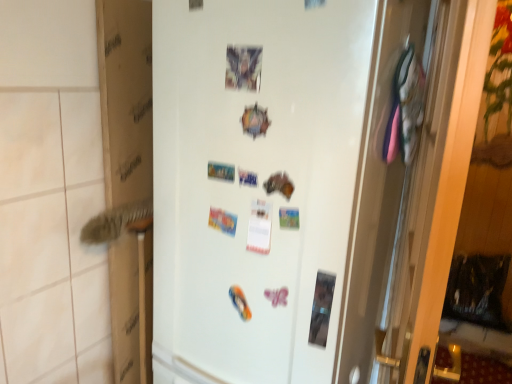
Locate an element on the screen. The height and width of the screenshot is (384, 512). cardboard at left is located at coordinates (126, 99).

Where is `white matte refrigerator at center`? white matte refrigerator at center is located at coordinates (254, 185).

Image resolution: width=512 pixels, height=384 pixels. Identify the location of cardboard at left. (126, 99).

From the picture: Does cardboard at left turn towards matte plastic postcard at upper center?

Yes, cardboard at left faces towards matte plastic postcard at upper center.

What's the angular difference between cardboard at left and matte plastic postcard at upper center's facing directions?

cardboard at left and matte plastic postcard at upper center are facing 88.6 degrees away from each other.

Does point (150, 260) come farther from viewer compared to point (254, 63)?

Yes, it is.

In terms of size, does cardboard at left appear bigger or smaller than matte plastic postcard at upper center?

cardboard at left is bigger than matte plastic postcard at upper center.

Can you confirm if white matte refrigerator at center is bigger than cardboard at left?

Correct, white matte refrigerator at center is larger in size than cardboard at left.

Is the surface of white matte refrigerator at center in direct contact with cardboard at left?

No, white matte refrigerator at center is not making contact with cardboard at left.

Looking at this image, is white matte refrigerator at center at the left side of cardboard at left?

Incorrect, white matte refrigerator at center is not on the left side of cardboard at left.

Does white matte refrigerator at center turn towards cardboard at left?

No.

Based on their positions, is matte plastic postcard at upper center located to the left or right of cardboard at left?

matte plastic postcard at upper center is to the right of cardboard at left.

Considering the relative sizes of matte plastic postcard at upper center and cardboard at left in the image provided, is matte plastic postcard at upper center wider than cardboard at left?

In fact, matte plastic postcard at upper center might be narrower than cardboard at left.

Is cardboard at left at the back of matte plastic postcard at upper center?

matte plastic postcard at upper center is not turned away from cardboard at left.

Is matte plastic postcard at upper center in front of or behind cardboard at left in the image?

matte plastic postcard at upper center is in front of cardboard at left.

From the image's perspective, which is below, white matte refrigerator at center or matte plastic postcard at upper center?

white matte refrigerator at center appears lower in the image.

Is white matte refrigerator at center aimed at matte plastic postcard at upper center?

Yes, white matte refrigerator at center faces towards matte plastic postcard at upper center.

Considering their positions, is white matte refrigerator at center located in front of or behind matte plastic postcard at upper center?

Visually, white matte refrigerator at center is located in front of matte plastic postcard at upper center.

From a real-world perspective, between white matte refrigerator at center and matte plastic postcard at upper center, who is vertically higher?

matte plastic postcard at upper center is physically above.

Considering the sizes of matte plastic postcard at upper center and white matte refrigerator at center in the image, is matte plastic postcard at upper center taller or shorter than white matte refrigerator at center?

Clearly, matte plastic postcard at upper center is shorter compared to white matte refrigerator at center.

From a real-world perspective, between matte plastic postcard at upper center and white matte refrigerator at center, who is vertically higher?

matte plastic postcard at upper center is physically above.

Is matte plastic postcard at upper center wider or thinner than white matte refrigerator at center?

In the image, matte plastic postcard at upper center appears to be more narrow than white matte refrigerator at center.

From the image's perspective, between matte plastic postcard at upper center and white matte refrigerator at center, which one is located above?

matte plastic postcard at upper center, from the image's perspective.

Which of these two, cardboard at left or white matte refrigerator at center, is bigger?

With larger size is white matte refrigerator at center.

Could you tell me if cardboard at left is turned towards white matte refrigerator at center?

Yes, cardboard at left is oriented towards white matte refrigerator at center.

This screenshot has height=384, width=512. In order to click on cardboard box on the left of white matte refrigerator at center in this screenshot , I will do `click(126, 99)`.

At what (x,y) coordinates should I click in order to perform the action: click on postcard in front of the cardboard at left. Please return your answer as a coordinate pair (x, y). This screenshot has height=384, width=512. Looking at the image, I should click on (243, 67).

Where is `refrigerator that appears below the cardboard at left (from a real-world perspective)`? This screenshot has width=512, height=384. refrigerator that appears below the cardboard at left (from a real-world perspective) is located at coordinates (254, 185).

Estimate the real-world distances between objects in this image. Which object is closer to cardboard at left, white matte refrigerator at center or matte plastic postcard at upper center?

white matte refrigerator at center is closer to cardboard at left.

Considering their positions, is cardboard at left positioned further to white matte refrigerator at center than matte plastic postcard at upper center?

Among the two, cardboard at left is located further to white matte refrigerator at center.

Looking at the image, which one is located closer to white matte refrigerator at center, matte plastic postcard at upper center or cardboard at left?

matte plastic postcard at upper center is closer to white matte refrigerator at center.

Estimate the real-world distances between objects in this image. Which object is further from cardboard at left, matte plastic postcard at upper center or white matte refrigerator at center?

Based on the image, matte plastic postcard at upper center appears to be further to cardboard at left.

Considering their positions, is white matte refrigerator at center positioned further to matte plastic postcard at upper center than cardboard at left?

Among the two, cardboard at left is located further to matte plastic postcard at upper center.

When comparing their distances from matte plastic postcard at upper center, does cardboard at left or white matte refrigerator at center seem further?

Among the two, cardboard at left is located further to matte plastic postcard at upper center.

Image resolution: width=512 pixels, height=384 pixels. What are the coordinates of `cardboard box between matte plastic postcard at upper center and white matte refrigerator at center from top to bottom` in the screenshot? It's located at (126, 99).